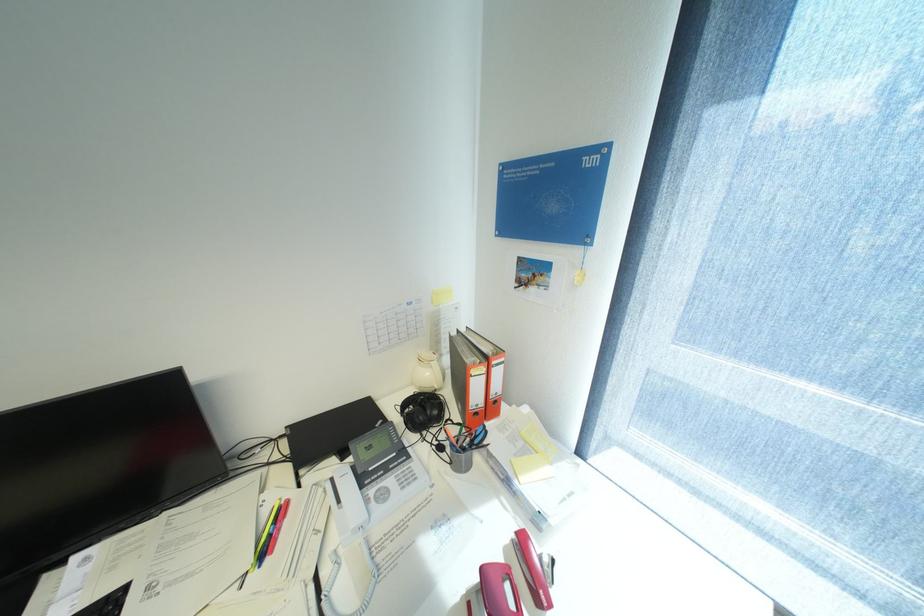
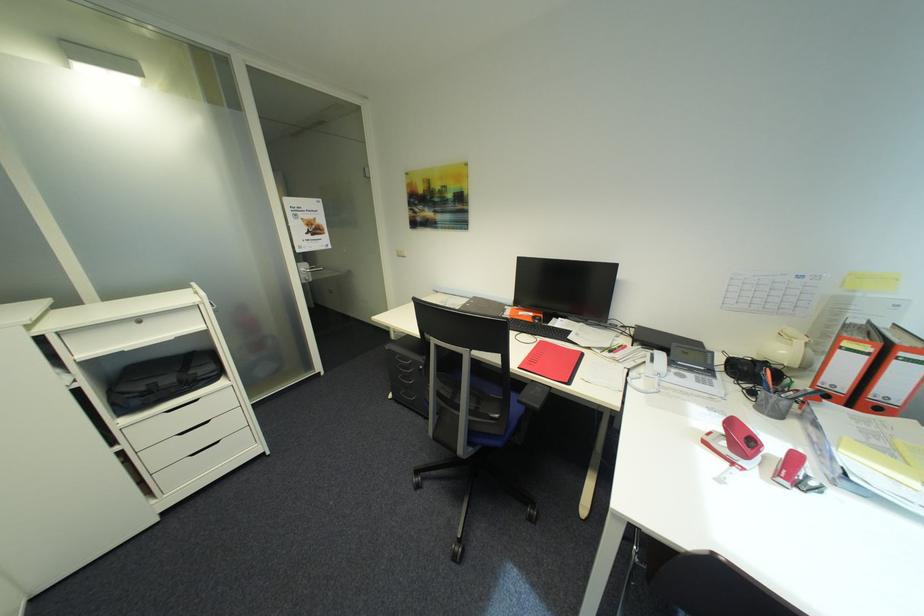
Locate, in the second image, the point that corresponds to the point at 447,448 in the first image.

(760, 392)